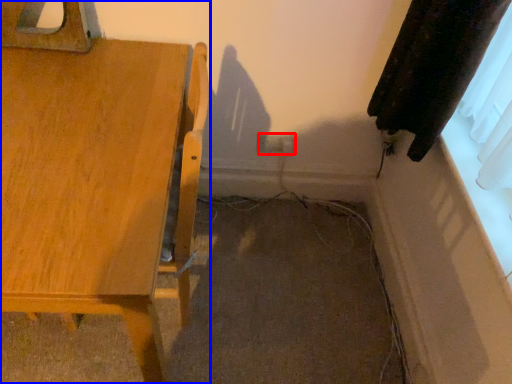
Question: Which object is further to the camera taking this photo, electric outlet (highlighted by a red box) or furniture (highlighted by a blue box)?

Choices:
 (A) electric outlet
 (B) furniture

Answer: (A)